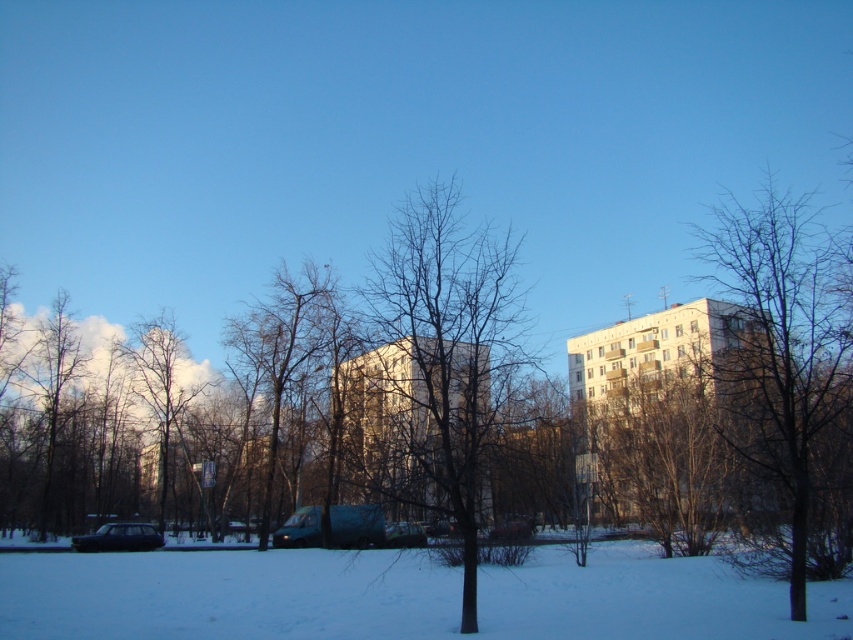
Does bare branches at right appear under shiny black car at lower left?

No, bare branches at right is not below shiny black car at lower left.

Which is in front, point (749, 237) or point (142, 548)?

Point (749, 237) is in front.

The height and width of the screenshot is (640, 853). In order to click on bare branches at right in this screenshot , I will do `click(782, 346)`.

Does bare branches at center appear over metallic blue van at center?

Correct, bare branches at center is located above metallic blue van at center.

Can you confirm if bare branches at center is positioned to the right of metallic blue van at center?

Yes, bare branches at center is to the right of metallic blue van at center.

Measure the distance between point (x=509, y=228) and camera.

Point (x=509, y=228) is 226.69 feet from camera.

I want to click on bare branches at center, so click(437, 365).

Can you confirm if metallic green van at center is taller than shiny black car at lower left?

Correct, metallic green van at center is much taller as shiny black car at lower left.

The width and height of the screenshot is (853, 640). I want to click on metallic green van at center, so click(x=357, y=525).

Where is `metallic green van at center`? metallic green van at center is located at coordinates (357, 525).